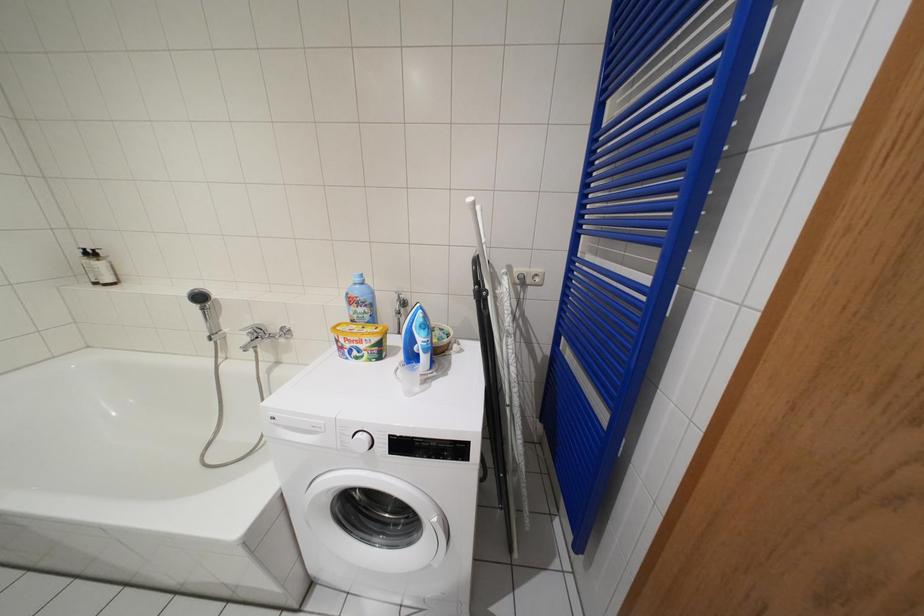
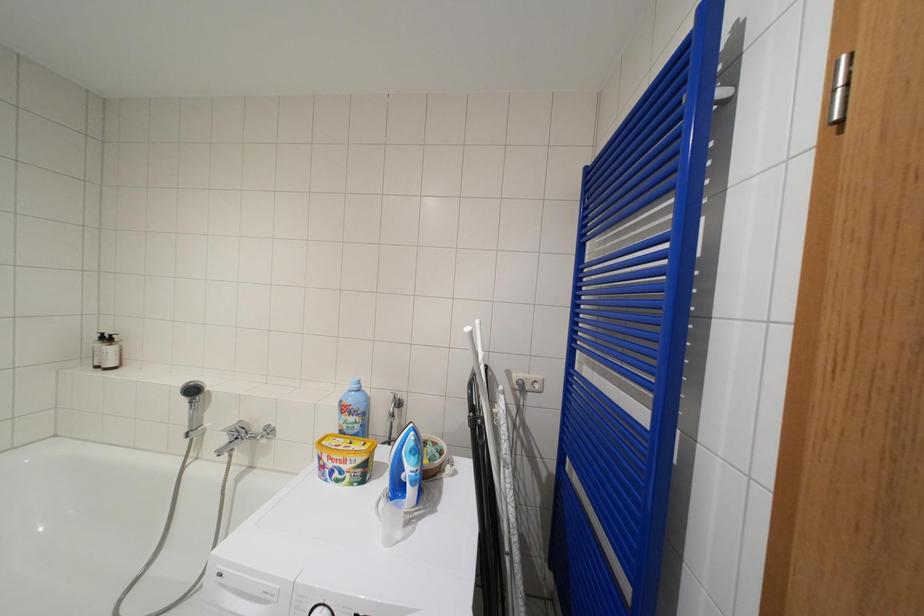
What movement of the cameraman would produce the second image?

The movement direction of the cameraman is right, backward.